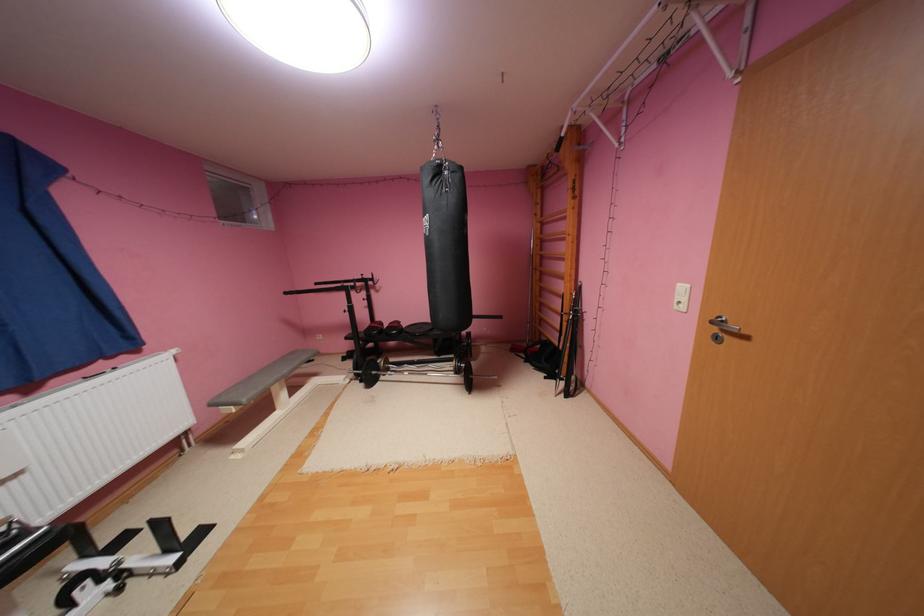
The height and width of the screenshot is (616, 924). I want to click on silver door handle, so click(723, 325).